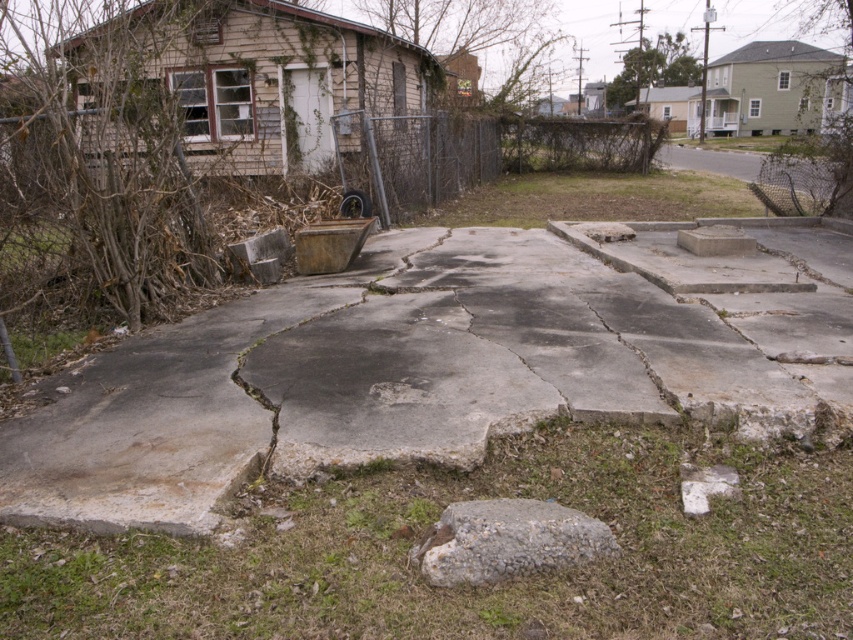
Consider the image. Can you confirm if gray concrete pavement at center is positioned below gray rough stone at lower center?

No, gray concrete pavement at center is not below gray rough stone at lower center.

Can you confirm if gray concrete pavement at center is smaller than gray rough stone at lower center?

Yes.

The width and height of the screenshot is (853, 640). Describe the element at coordinates (405, 378) in the screenshot. I see `gray concrete pavement at center` at that location.

Image resolution: width=853 pixels, height=640 pixels. I want to click on gray concrete pavement at center, so click(x=405, y=378).

Between point (48, 452) and point (683, 237), which one is positioned behind?

The point (683, 237) is more distant.

Who is taller, gray concrete pavement at center or gray concrete block at center?

With more height is gray concrete block at center.

You are a GUI agent. You are given a task and a screenshot of the screen. Output one action in this format:
    pyautogui.click(x=<x>, y=<y>)
    Task: Click on the gray concrete pavement at center
    The height and width of the screenshot is (640, 853).
    Given the screenshot: What is the action you would take?
    pyautogui.click(x=405, y=378)

Can you confirm if gray rough stone at lower center is thinner than gray concrete block at center?

No.

Can you confirm if gray rough stone at lower center is positioned above gray concrete block at center?

Actually, gray rough stone at lower center is below gray concrete block at center.

Who is more forward, (480,545) or (714,253)?

Point (480,545) is more forward.

Identify the location of gray rough stone at lower center. This screenshot has width=853, height=640. (508, 540).